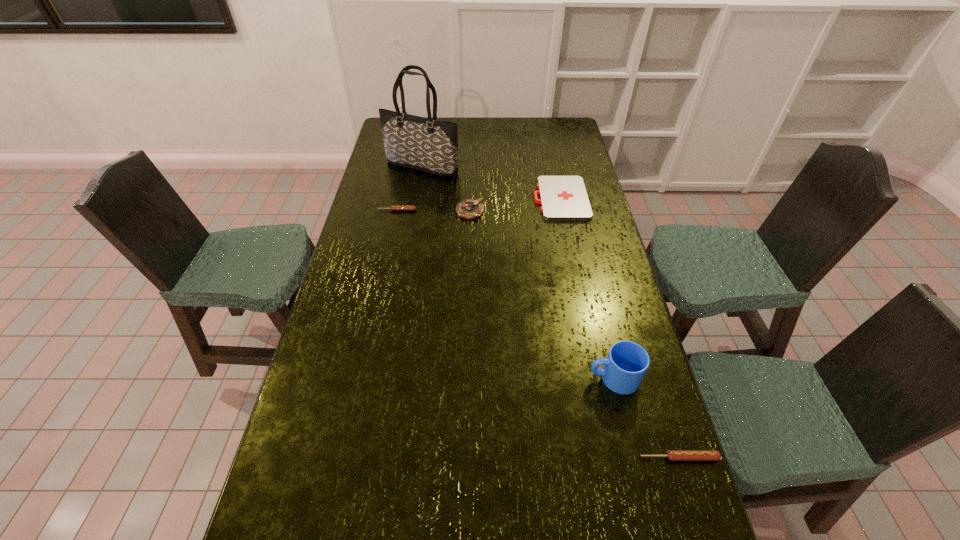
Find the location of `the fifth closest object to the fifth tallest object`. the fifth closest object to the fifth tallest object is located at coordinates (673, 455).

Where is `vacant space that satisfies the following two spatial constraints: 1. on the front side of the fourth tallest object; 2. on the left side of the third tallest object`? The width and height of the screenshot is (960, 540). vacant space that satisfies the following two spatial constraints: 1. on the front side of the fourth tallest object; 2. on the left side of the third tallest object is located at coordinates (464, 457).

Identify the location of free region that satisfies the following two spatial constraints: 1. on the back side of the right sausage; 2. on the side of the second nearest object with the handle. [x=654, y=378].

Identify the location of vacant area in the image that satisfies the following two spatial constraints: 1. on handle side the first-aid kit; 2. on the right side of the nearer sausage. (615, 457).

Image resolution: width=960 pixels, height=540 pixels. I want to click on free space that satisfies the following two spatial constraints: 1. on the back side of the fourth tallest object; 2. on the side of the second nearest object with the handle, so click(654, 378).

Locate an element on the screen. Image resolution: width=960 pixels, height=540 pixels. blank area in the image that satisfies the following two spatial constraints: 1. on handle side the first-aid kit; 2. on the front side of the fifth tallest object is located at coordinates (563, 210).

Locate an element on the screen. The width and height of the screenshot is (960, 540). vacant region that satisfies the following two spatial constraints: 1. on handle side the first-aid kit; 2. on the right side of the nearer sausage is located at coordinates (615, 457).